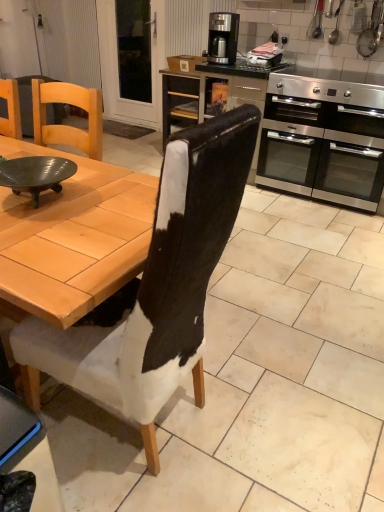
Find the location of a particular element. vacant space behind matte black bowl at left is located at coordinates (89, 173).